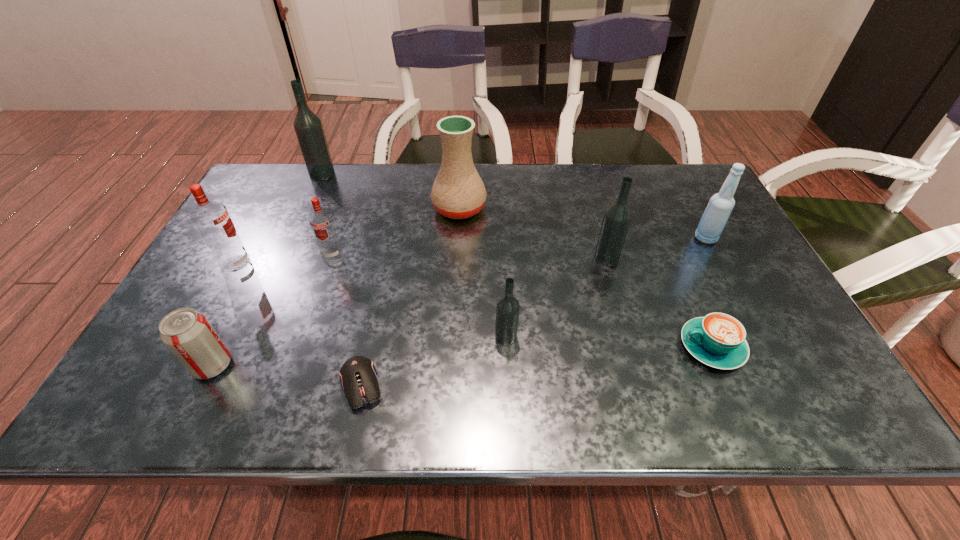
This screenshot has width=960, height=540. Find the location of `free space located with the handle on the right side of the second shortest object`. free space located with the handle on the right side of the second shortest object is located at coordinates (507, 347).

This screenshot has width=960, height=540. Find the location of `free region located 0.400m on the back of the fifth object from left to right`. free region located 0.400m on the back of the fifth object from left to right is located at coordinates (393, 238).

This screenshot has width=960, height=540. Find the location of `vodka present at the far edge`. vodka present at the far edge is located at coordinates (308, 127).

In order to click on pottery that is at the far edge in this screenshot , I will do `click(458, 192)`.

The image size is (960, 540). I want to click on soda can at the near edge, so (x=187, y=333).

You are a GUI agent. You are given a task and a screenshot of the screen. Output one action in this format:
    pyautogui.click(x=<x>, y=<y>)
    Task: Click on the computer mouse that is positioned at the near edge
    
    Given the screenshot: What is the action you would take?
    pyautogui.click(x=358, y=376)

This screenshot has width=960, height=540. Find the location of `soda can at the left edge`. soda can at the left edge is located at coordinates coord(187,333).

Image resolution: width=960 pixels, height=540 pixels. In order to click on bottle that is at the right edge in this screenshot , I will do `click(720, 206)`.

Where is `cappuccino that is at the right edge`? cappuccino that is at the right edge is located at coordinates (718, 340).

The height and width of the screenshot is (540, 960). In order to click on object at the far left corner in this screenshot , I will do `click(308, 127)`.